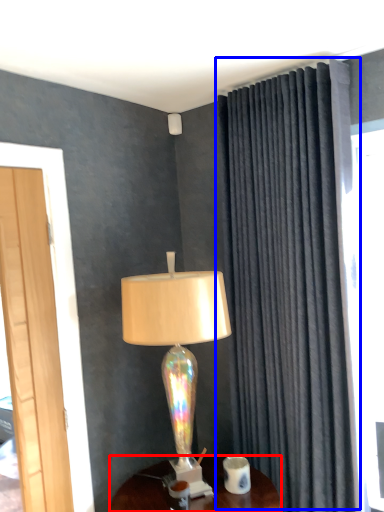
Question: Among these objects, which one is farthest to the camera, desk (highlighted by a red box) or curtain (highlighted by a blue box)?

Choices:
 (A) desk
 (B) curtain

Answer: (B)